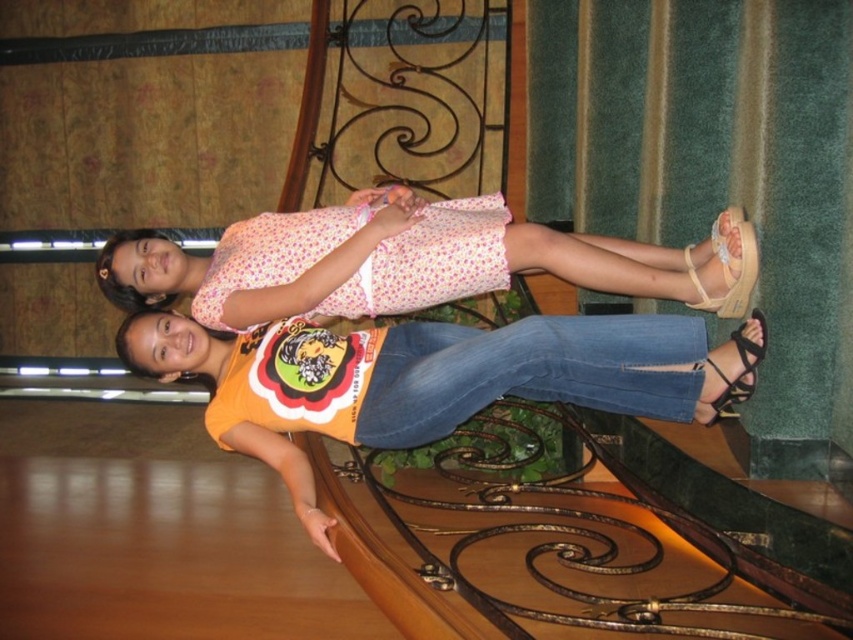
Question: Which object is farther from the camera taking this photo?

Choices:
 (A) beige fabric sandal at lower right
 (B) pink floral dress at center
 (C) orange cotton t-shirt at center

Answer: (B)

Question: Which of the following is the closest to the observer?

Choices:
 (A) orange cotton t-shirt at center
 (B) black leather sandal at lower right
 (C) beige fabric sandal at lower right

Answer: (B)

Question: Can you confirm if pink floral dress at center is positioned to the left of black leather sandal at lower right?

Choices:
 (A) no
 (B) yes

Answer: (B)

Question: Among these points, which one is nearest to the camera?

Choices:
 (A) 747,301
 (B) 735,394
 (C) 248,305
 (D) 399,420

Answer: (B)

Question: Is orange cotton t-shirt at center below beige fabric sandal at lower right?

Choices:
 (A) yes
 (B) no

Answer: (A)

Question: Does orange cotton t-shirt at center have a greater width compared to beige fabric sandal at lower right?

Choices:
 (A) yes
 (B) no

Answer: (A)